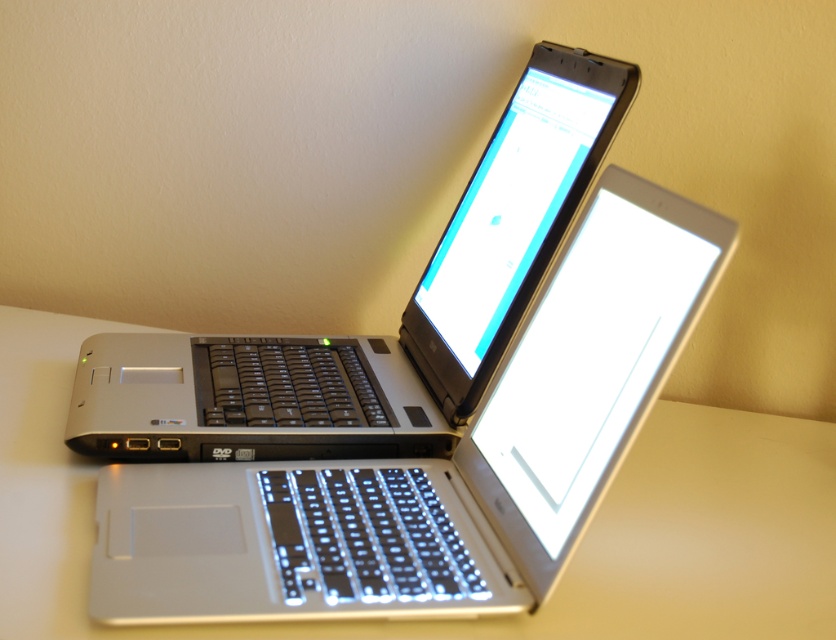
You are setting up a workspace and need to place a 12 inch monitor between the white matte table at center and the satin silver laptop at center. Can the monitor fit in the space between them?

The white matte table at center is only 10.85 inches from the satin silver laptop at center, so a 12 inch monitor cannot fit in the space between them.

You are organizing a workspace and need to place a new monitor on the white matte table at center. Considering the current setup with the satin silver laptop at center, where should you position the monitor relative to the laptop?

The white matte table at center is located below the satin silver laptop at center, so placing the monitor to the side or behind the laptop would be appropriate to ensure visibility and workspace efficiency.

You are organizing a small workspace and have two laptops that need to be placed on the white matte table at center. The laptops must be positioned so that there is at least 60 centimeters between them for ergonomic reasons. Can you place them according to this requirement?

The two laptops are 61.47 centimeters apart, which exceeds the minimum requirement of 60 centimeters, so they can be placed according to the ergonomic requirement.